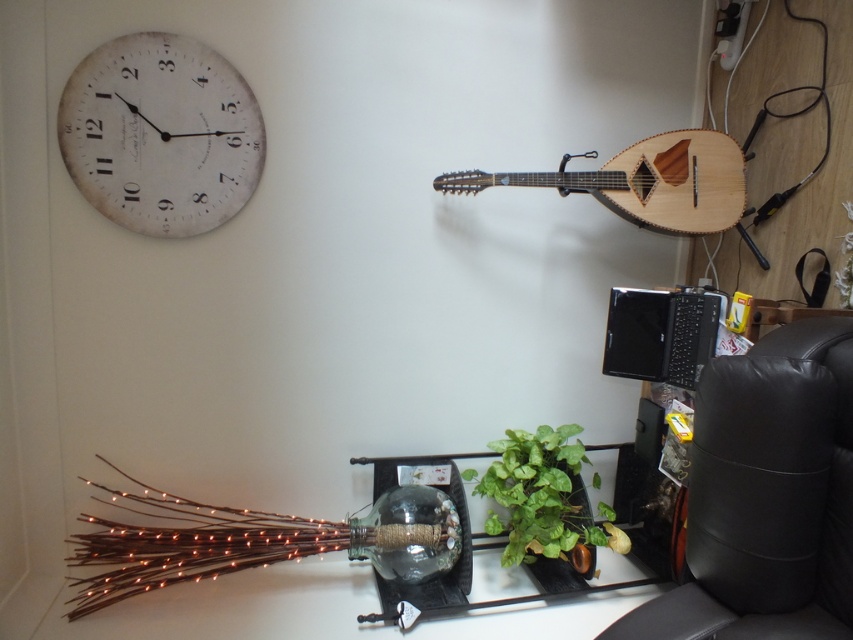
Does point (628, 196) come farther from viewer compared to point (408, 588)?

No, it is not.

Consider the image. Between natural wood mandolin at upper center and transparent glass vase at center, which one appears on the left side from the viewer's perspective?

Positioned to the left is transparent glass vase at center.

The image size is (853, 640). Describe the element at coordinates (646, 182) in the screenshot. I see `natural wood mandolin at upper center` at that location.

I want to click on natural wood mandolin at upper center, so click(646, 182).

Is point (703, 545) in front of point (384, 605)?

Yes.

Which is in front, point (786, 355) or point (404, 586)?

Positioned in front is point (786, 355).

Is point (693, 540) more distant than point (610, 586)?

No, it is in front of (610, 586).

Where is `black leather armchair at right`? This screenshot has width=853, height=640. black leather armchair at right is located at coordinates (766, 497).

In order to click on black leather armchair at right in this screenshot , I will do tap(766, 497).

Between black leather armchair at right and natural wood mandolin at upper center, which one has less height?

natural wood mandolin at upper center

Is point (780, 435) farther from viewer compared to point (505, 177)?

No, it is not.

I want to click on black leather armchair at right, so click(x=766, y=497).